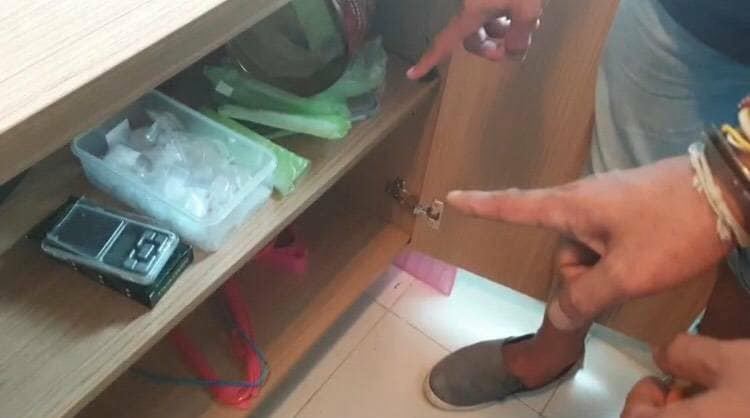
Find the location of a particular element. This screenshot has width=750, height=418. tiled floor is located at coordinates (404, 377).